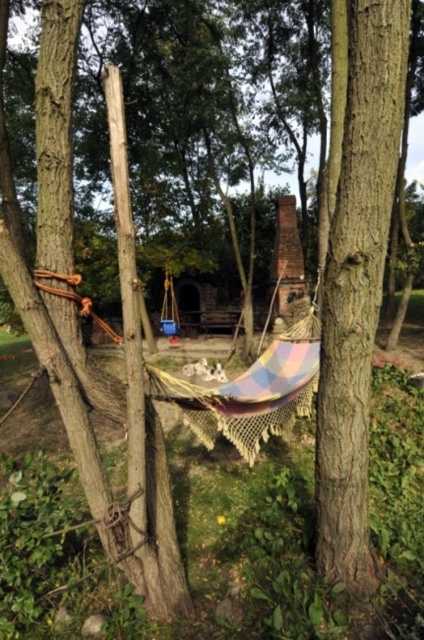
Question: Which point appears farthest from the camera in this image?

Choices:
 (A) (10, 268)
 (B) (343, 538)

Answer: (B)

Question: Is smooth brown tree trunk at center to the right of rough wood tree trunk at left from the viewer's perspective?

Choices:
 (A) no
 (B) yes

Answer: (B)

Question: Which of the following is the farthest from the observer?

Choices:
 (A) (349, 132)
 (B) (178, 612)

Answer: (B)

Question: Which point is farther to the camera?

Choices:
 (A) [64, 116]
 (B) [357, 74]

Answer: (A)

Question: Can you confirm if smooth brown tree trunk at center is positioned above rough wood tree trunk at left?

Choices:
 (A) no
 (B) yes

Answer: (B)

Question: From the image, what is the correct spatial relationship of smooth brown tree trunk at center in relation to rough wood tree trunk at left?

Choices:
 (A) right
 (B) left

Answer: (A)